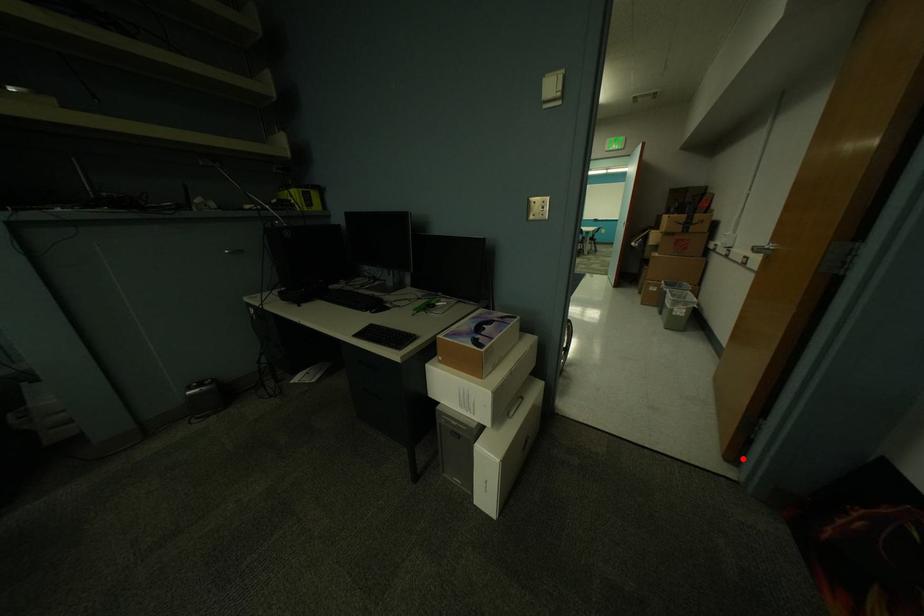
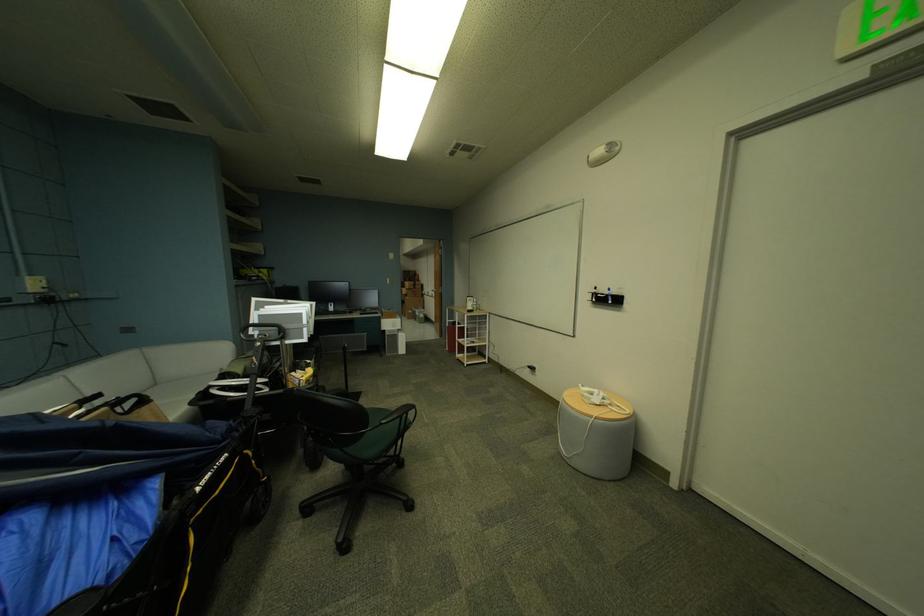
Where in the second image is the point corresponding to the highlighted location from the first image?

(450, 337)